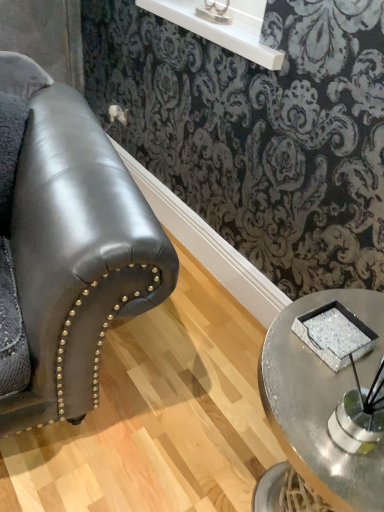
Find the location of a particular element. The height and width of the screenshot is (512, 384). vacant area to the left of sparkly silver tray at center is located at coordinates (281, 345).